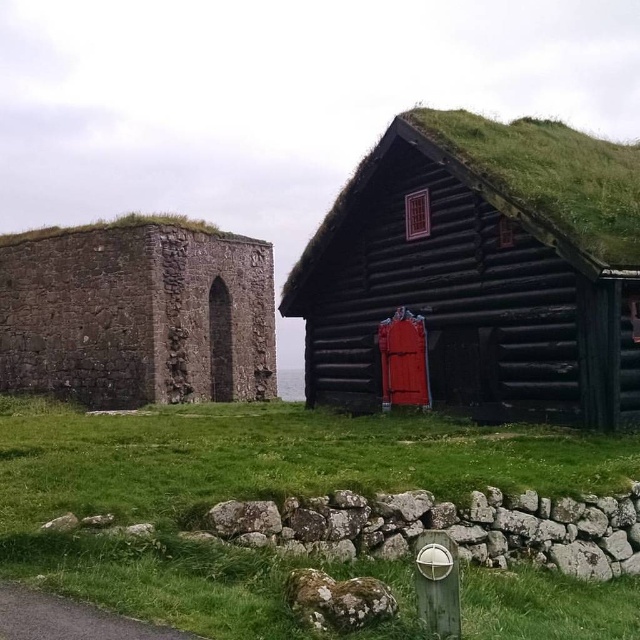
The height and width of the screenshot is (640, 640). I want to click on green grass at lower center, so click(243, 492).

Is green grass at lower center taller than dark brown wooden log cabin at center?

No, green grass at lower center is not taller than dark brown wooden log cabin at center.

What do you see at coordinates (243, 492) in the screenshot?
I see `green grass at lower center` at bounding box center [243, 492].

Find the location of a particular element. The width and height of the screenshot is (640, 640). green grass at lower center is located at coordinates (243, 492).

Between dark brown wooden log cabin at center and rustic stone wall at left, which one is positioned higher?

Positioned higher is dark brown wooden log cabin at center.

Does dark brown wooden log cabin at center have a lesser width compared to rustic stone wall at left?

Yes, dark brown wooden log cabin at center is thinner than rustic stone wall at left.

Identify the location of dark brown wooden log cabin at center. (483, 269).

At what (x,y) coordinates should I click in order to perform the action: click on dark brown wooden log cabin at center. Please return your answer as a coordinate pair (x, y). The image size is (640, 640). Looking at the image, I should click on (483, 269).

Measure the distance between green grass at lower center and rustic stone wall at left.

green grass at lower center and rustic stone wall at left are 12.06 meters apart.

Is green grass at lower center closer to the viewer compared to rustic stone wall at left?

Yes.

This screenshot has height=640, width=640. In order to click on green grass at lower center in this screenshot , I will do `click(243, 492)`.

The image size is (640, 640). What are the coordinates of `green grass at lower center` in the screenshot? It's located at 243,492.